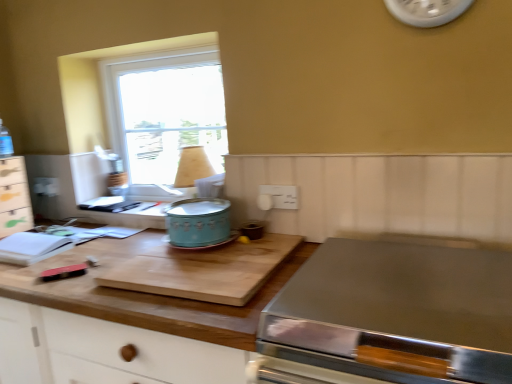
Where is `white plastic clock at upper right`? This screenshot has height=384, width=512. white plastic clock at upper right is located at coordinates (426, 11).

The image size is (512, 384). Describe the element at coordinates (164, 109) in the screenshot. I see `clear glass window at upper left` at that location.

Locate an element on the screen. teal enamel crock pot at center is located at coordinates (198, 222).

The image size is (512, 384). What are the coordinates of `wooden cutting board at center` in the screenshot? It's located at (203, 270).

What do you see at coordinates (14, 197) in the screenshot? The image size is (512, 384). I see `white wood drawer at left` at bounding box center [14, 197].

What are the coordinates of `white plastic clock at upper right` in the screenshot? It's located at (426, 11).

Is white wood drawer at left positioned far away from wooden cutting board at center?

They are positioned close to each other.

Considering the relative sizes of white wood drawer at left and wooden cutting board at center in the image provided, is white wood drawer at left shorter than wooden cutting board at center?

Correct, white wood drawer at left is not as tall as wooden cutting board at center.

Choose the correct answer: Is white wood drawer at left inside wooden cutting board at center or outside it?

white wood drawer at left is outside wooden cutting board at center.

Which is behind, wooden cutting board at center or white plastic clock at upper right?

white plastic clock at upper right is further from the camera.

How much distance is there between wooden cutting board at center and white plastic clock at upper right?

They are 1.02 meters apart.

The width and height of the screenshot is (512, 384). Find the location of `clock above the wooden cutting board at center (from the image's perspective)`. clock above the wooden cutting board at center (from the image's perspective) is located at coordinates (426, 11).

Is wooden cutting board at center facing towards white plastic clock at upper right?

No, wooden cutting board at center is not aimed at white plastic clock at upper right.

Looking at this image, in terms of height, does white wood drawer at left look taller or shorter compared to clear glass window at upper left?

Considering their sizes, white wood drawer at left has less height than clear glass window at upper left.

What's the angular difference between white wood drawer at left and clear glass window at upper left's facing directions?

The facing directions of white wood drawer at left and clear glass window at upper left are 85.8 degrees apart.

From a real-world perspective, which is physically below, white wood drawer at left or clear glass window at upper left?

From a 3D spatial view, white wood drawer at left is below.

Based on the photo, considering the sizes of objects stainless steel cooktop at lower right and white plastic clock at upper right in the image provided, who is smaller, stainless steel cooktop at lower right or white plastic clock at upper right?

Smaller between the two is white plastic clock at upper right.

Which object is wider, stainless steel cooktop at lower right or white plastic clock at upper right?

Wider between the two is stainless steel cooktop at lower right.

Which object is closer to the camera, stainless steel cooktop at lower right or white plastic clock at upper right?

stainless steel cooktop at lower right is in front.

From the image's perspective, would you say white wood drawer at left is positioned over teal enamel crock pot at center?

Indeed, from the image's perspective, white wood drawer at left is shown above teal enamel crock pot at center.

From a real-world perspective, who is located higher, white wood drawer at left or teal enamel crock pot at center?

white wood drawer at left, from a real-world perspective.

Does white wood drawer at left have a lesser height compared to teal enamel crock pot at center?

No.

From a real-world perspective, relative to wooden cutting board at center, is white plastic clock at upper right vertically above or below?

white plastic clock at upper right is above wooden cutting board at center.

From the image's perspective, who appears lower, white plastic clock at upper right or wooden cutting board at center?

From the image's view, wooden cutting board at center is below.

Is white plastic clock at upper right not close to wooden cutting board at center?

They are positioned close to each other.

How much distance is there between white plastic clock at upper right and wooden cutting board at center?

The distance of white plastic clock at upper right from wooden cutting board at center is 89.71 centimeters.

Based on the photo, is wooden cutting board at center situated inside stainless steel cooktop at lower right or outside?

wooden cutting board at center is not enclosed by stainless steel cooktop at lower right.

Locate an element on the screen. cutting board above the stainless steel cooktop at lower right (from the image's perspective) is located at coordinates (203, 270).

Between wooden cutting board at center and stainless steel cooktop at lower right, which one is positioned in front?

stainless steel cooktop at lower right.

This screenshot has width=512, height=384. I want to click on countertop lying on the right of white wood drawer at left, so click(148, 293).

Where is `clock above the wooden cutting board at center (from the image's perspective)`? This screenshot has width=512, height=384. clock above the wooden cutting board at center (from the image's perspective) is located at coordinates (426, 11).

From the image, which object appears to be nearer to white wood drawer at left, clear glass window at upper left or stainless steel cooktop at lower right?

clear glass window at upper left is positioned closer to the anchor white wood drawer at left.

Which object lies further to the anchor point clear glass window at upper left, wooden cutting board at center or wooden cutting board at center?

wooden cutting board at center is positioned further to the anchor clear glass window at upper left.

Based on their spatial positions, is wooden cutting board at center or white wood drawer at left further from wooden cutting board at center?

white wood drawer at left.

From the image, which object appears to be nearer to teal enamel crock pot at center, wooden cutting board at center or white plastic clock at upper right?

Among the two, wooden cutting board at center is located nearer to teal enamel crock pot at center.

From the image, which object appears to be farther from teal enamel crock pot at center, stainless steel cooktop at lower right or clear glass window at upper left?

clear glass window at upper left lies further to teal enamel crock pot at center than the other object.

Estimate the real-world distances between objects in this image. Which object is further from stainless steel cooktop at lower right, white plastic clock at upper right or wooden cutting board at center?

The object further to stainless steel cooktop at lower right is white plastic clock at upper right.

Based on the photo, estimate the real-world distances between objects in this image. Which object is further from clear glass window at upper left, stainless steel cooktop at lower right or wooden cutting board at center?

stainless steel cooktop at lower right.

Looking at the image, which one is located closer to white plastic clock at upper right, wooden cutting board at center or stainless steel cooktop at lower right?

stainless steel cooktop at lower right is closer to white plastic clock at upper right.

Where is `appliance positioned between stainless steel cooktop at lower right and clear glass window at upper left from near to far`? appliance positioned between stainless steel cooktop at lower right and clear glass window at upper left from near to far is located at coordinates (198, 222).

Locate an element on the screen. appliance that lies between white plastic clock at upper right and wooden cutting board at center from top to bottom is located at coordinates (198, 222).

Where is `countertop between white wood drawer at left and white plastic clock at upper right`? countertop between white wood drawer at left and white plastic clock at upper right is located at coordinates (148, 293).

I want to click on cutting board positioned between stainless steel cooktop at lower right and teal enamel crock pot at center from near to far, so click(x=203, y=270).